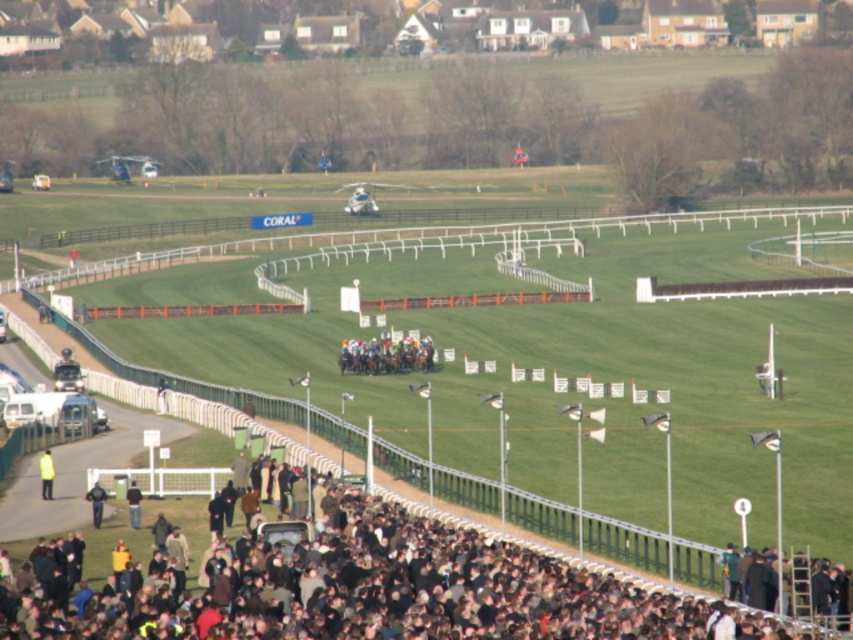
I want to click on neon yellow jacket at lower left, so click(x=45, y=474).

Between point (42, 465) and point (137, 518), which one is positioned in front?

Positioned in front is point (137, 518).

The height and width of the screenshot is (640, 853). Identify the location of neon yellow jacket at lower left. (45, 474).

Is point (247, 544) positioned in front of point (49, 492)?

Yes, it is.

Who is positioned more to the right, dark brown fur coat at lower center or neon yellow jacket at lower left?

From the viewer's perspective, dark brown fur coat at lower center appears more on the right side.

Where is `dark brown fur coat at lower center`? The width and height of the screenshot is (853, 640). dark brown fur coat at lower center is located at coordinates (364, 593).

Locate an element on the screen. The height and width of the screenshot is (640, 853). dark brown fur coat at lower center is located at coordinates (364, 593).

Does dark brown fur coat at lower center appear on the right side of dark gray jacket at lower center?

Yes, dark brown fur coat at lower center is to the right of dark gray jacket at lower center.

Does dark brown fur coat at lower center appear on the left side of dark gray jacket at lower center?

Incorrect, dark brown fur coat at lower center is not on the left side of dark gray jacket at lower center.

Which is in front, point (53, 630) or point (131, 520)?

Point (53, 630) is in front.

Locate an element on the screen. This screenshot has height=640, width=853. dark brown fur coat at lower center is located at coordinates (364, 593).